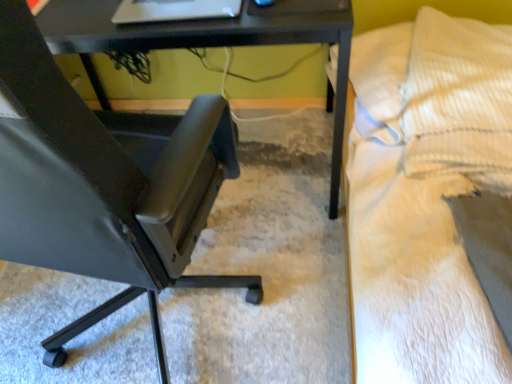
Where is `empty space that is in between matte black chair at left and black plastic table at center`? Image resolution: width=512 pixels, height=384 pixels. empty space that is in between matte black chair at left and black plastic table at center is located at coordinates click(x=213, y=293).